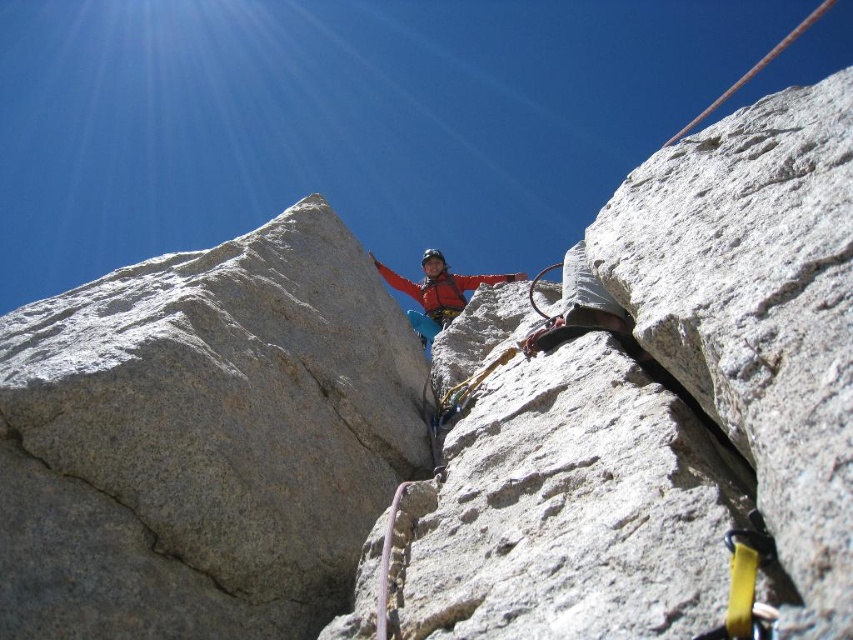
Question: Which point is farther to the camera?

Choices:
 (A) (596, 490)
 (B) (271, 394)
 (C) (416, 323)

Answer: (C)

Question: Is white granite rock at center positioned before matte red jacket at center?

Choices:
 (A) yes
 (B) no

Answer: (A)

Question: Which object is the closest to the gray granite rock at center?

Choices:
 (A) white granite rock at center
 (B) matte red jacket at center

Answer: (A)

Question: Is gray granite rock at center further to camera compared to matte red jacket at center?

Choices:
 (A) no
 (B) yes

Answer: (A)

Question: Which point appears farthest from the camera in this image?

Choices:
 (A) (811, 208)
 (B) (273, 516)

Answer: (B)

Question: Is gray granite rock at center thinner than matte red jacket at center?

Choices:
 (A) yes
 (B) no

Answer: (A)